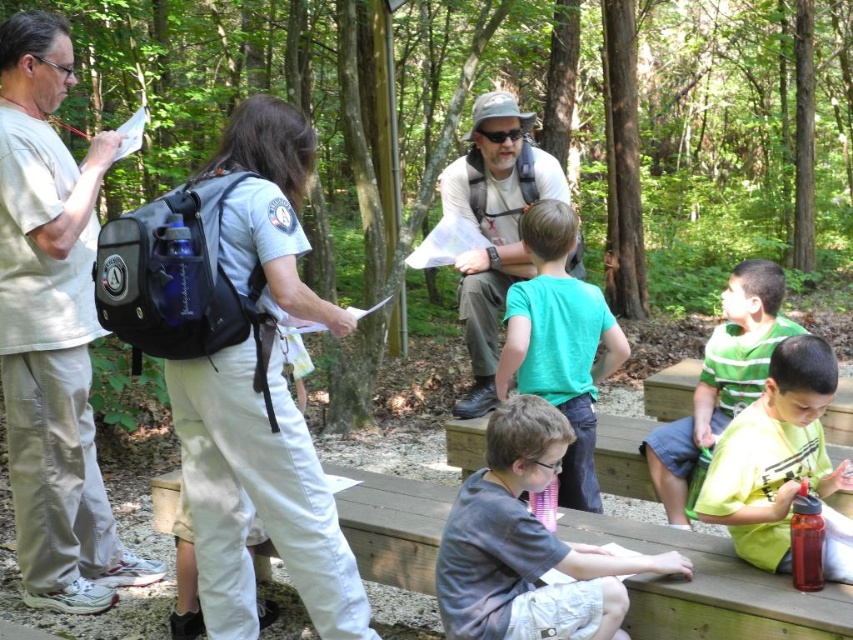
Image resolution: width=853 pixels, height=640 pixels. Describe the element at coordinates (712, 589) in the screenshot. I see `wooden picnic table at lower center` at that location.

Can you confirm if wooden picnic table at lower center is positioned above matte gray backpack at center?

Incorrect, wooden picnic table at lower center is not positioned above matte gray backpack at center.

Does point (706, 627) come behind point (509, 145)?

No, (706, 627) is closer to viewer.

At what (x,y) coordinates should I click in order to perform the action: click on wooden picnic table at lower center. Please return your answer as a coordinate pair (x, y). Image resolution: width=853 pixels, height=640 pixels. Looking at the image, I should click on (712, 589).

Is gray cotton shirt at lower center above teal t-shirt at center?

No.

Between point (519, 605) and point (612, 362), which one is positioned in front?

Point (519, 605) is more forward.

Identify the location of gray cotton shirt at lower center. (527, 545).

I want to click on matte green shirt at lower right, so click(x=775, y=454).

Does matte green shirt at lower right come in front of matte gray backpack at center?

That is True.

Does point (808, 362) come farther from viewer compared to point (473, 268)?

No.

Locate an element on the screen. The image size is (853, 640). matte green shirt at lower right is located at coordinates (775, 454).